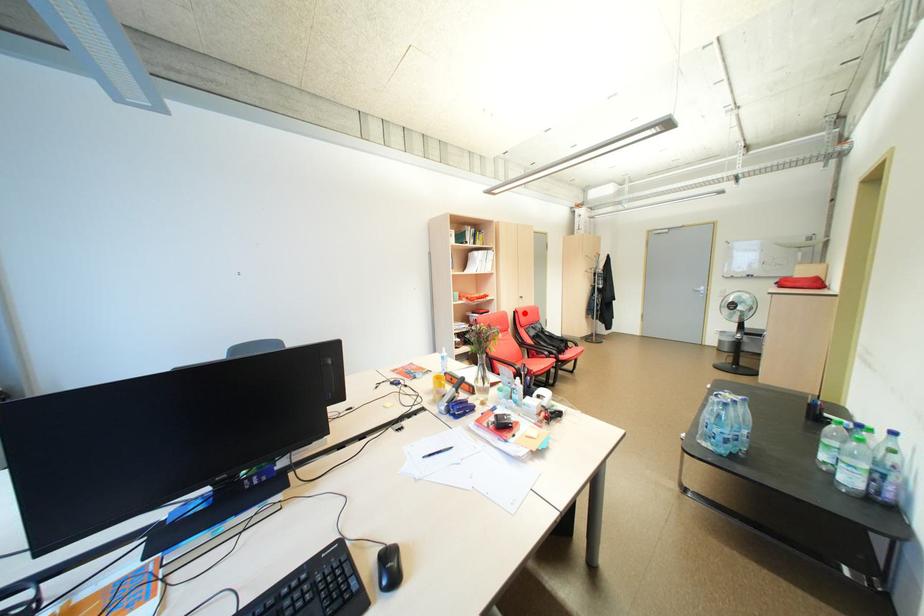
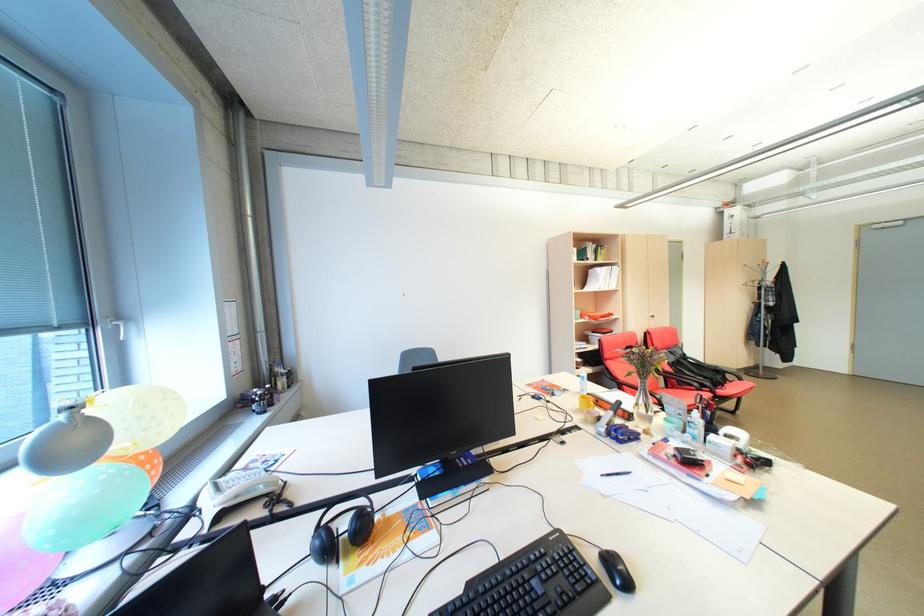
Find the pixel in the second image that matches the highlighted location in the first image.

(655, 334)